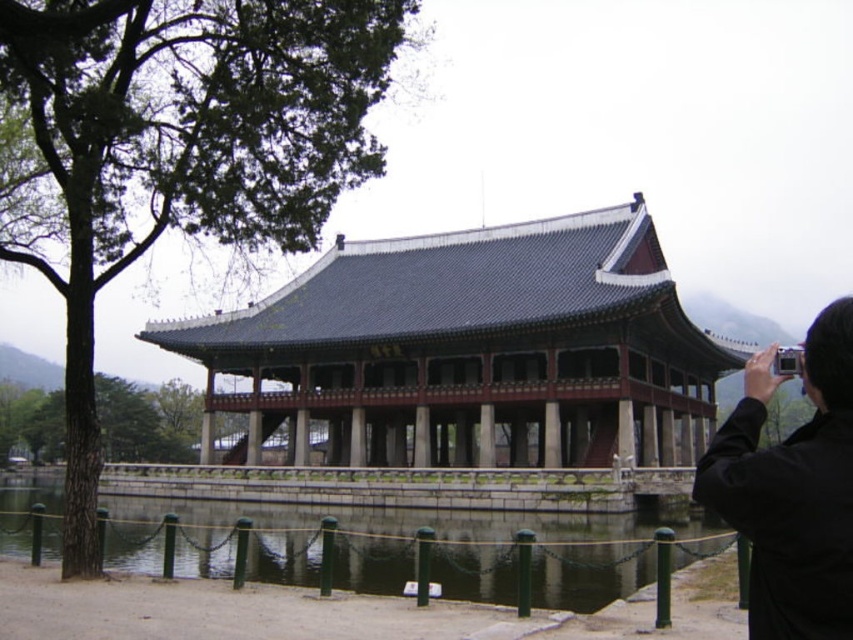
In the scene shown: You are standing at the camera position and want to reach the point marked at coordinates (405,346). Given that your walking speed is 1.5 meters per second, approximately how many seconds will it take you to reach that point?

The point marked at coordinates (405,346) is 88.39 meters away from the camera. At a walking speed of 1.5 meters per second, it would take approximately 59 seconds to reach the point.

You are a photographer wanting to capture the reflection of the pavilion in the clear water at pond center. However, you have the black fabric camera at upper right. Will the camera block the reflection when you take the photo?

The black fabric camera at upper right is behind clear water at pond center, so it will not block the reflection when taking the photo.